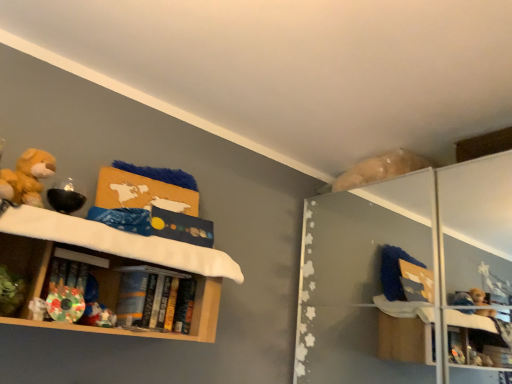
Question: Is hardcover books at shelf center aimed at wooden shelf at left?

Choices:
 (A) no
 (B) yes

Answer: (B)

Question: From a real-world perspective, is hardcover books at shelf center beneath wooden shelf at left?

Choices:
 (A) yes
 (B) no

Answer: (A)

Question: Is hardcover books at shelf center wider than wooden shelf at left?

Choices:
 (A) yes
 (B) no

Answer: (B)

Question: Is wooden shelf at left completely or partially inside hardcover books at shelf center?

Choices:
 (A) no
 (B) yes

Answer: (A)

Question: Is hardcover books at shelf center outside of wooden shelf at left?

Choices:
 (A) no
 (B) yes

Answer: (A)

Question: In terms of size, does wooden shelf at left appear bigger or smaller than fluffy yellow teddy bear at left?

Choices:
 (A) small
 (B) big

Answer: (B)

Question: Is wooden shelf at left taller or shorter than fluffy yellow teddy bear at left?

Choices:
 (A) short
 (B) tall

Answer: (B)

Question: From a real-world perspective, is wooden shelf at left positioned above or below fluffy yellow teddy bear at left?

Choices:
 (A) below
 (B) above

Answer: (A)

Question: Is wooden shelf at left in front of or behind fluffy yellow teddy bear at left in the image?

Choices:
 (A) front
 (B) behind

Answer: (A)

Question: From a real-world perspective, is fluffy yellow teddy bear at left positioned above or below hardcover books at shelf center?

Choices:
 (A) below
 (B) above

Answer: (B)

Question: Choose the correct answer: Is fluffy yellow teddy bear at left inside hardcover books at shelf center or outside it?

Choices:
 (A) outside
 (B) inside

Answer: (A)

Question: In terms of width, does fluffy yellow teddy bear at left look wider or thinner when compared to hardcover books at shelf center?

Choices:
 (A) wide
 (B) thin

Answer: (A)

Question: Looking at the image, does fluffy yellow teddy bear at left seem bigger or smaller compared to hardcover books at shelf center?

Choices:
 (A) small
 (B) big

Answer: (A)

Question: Is fluffy yellow teddy bear at left situated inside wooden shelf at left or outside?

Choices:
 (A) outside
 (B) inside

Answer: (A)

Question: Considering the positions of fluffy yellow teddy bear at left and wooden shelf at left in the image, is fluffy yellow teddy bear at left wider or thinner than wooden shelf at left?

Choices:
 (A) thin
 (B) wide

Answer: (A)